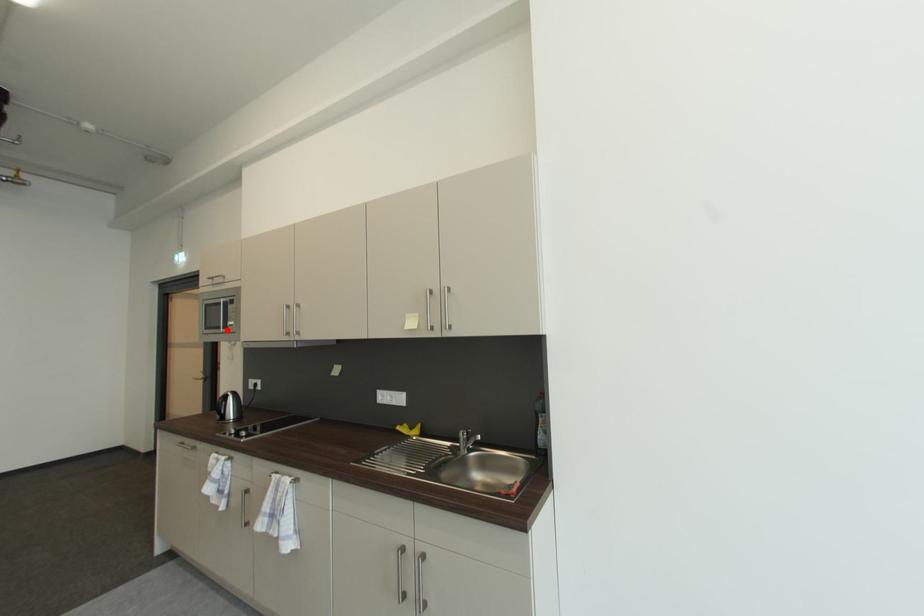
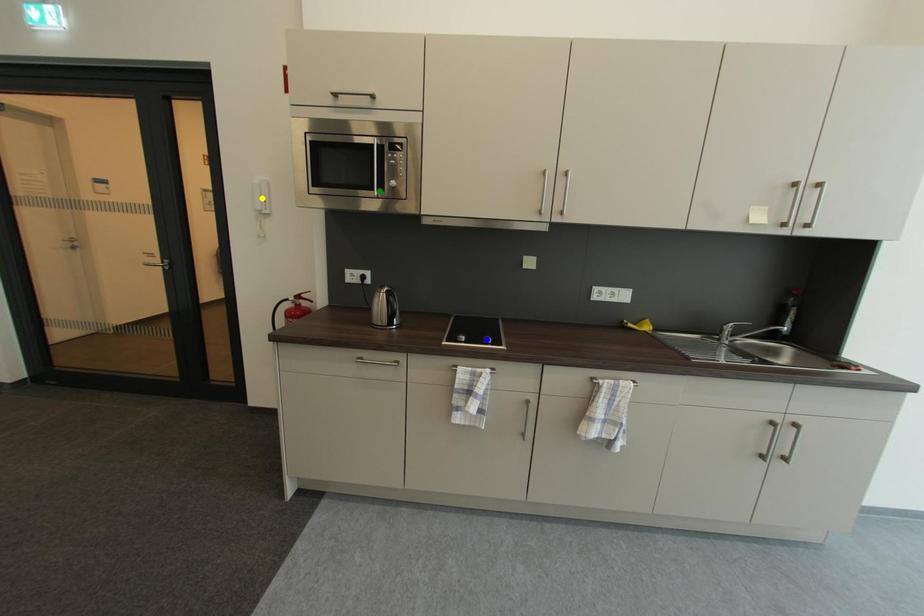
Question: I am providing you with two images of the same scene from different viewpoints. A red point is marked on the first image. You are given multiple points on the second image. Which mark in image 2 goes with the point in image 1?

Choices:
 (A) yellow point
 (B) green point
 (C) blue point

Answer: (B)